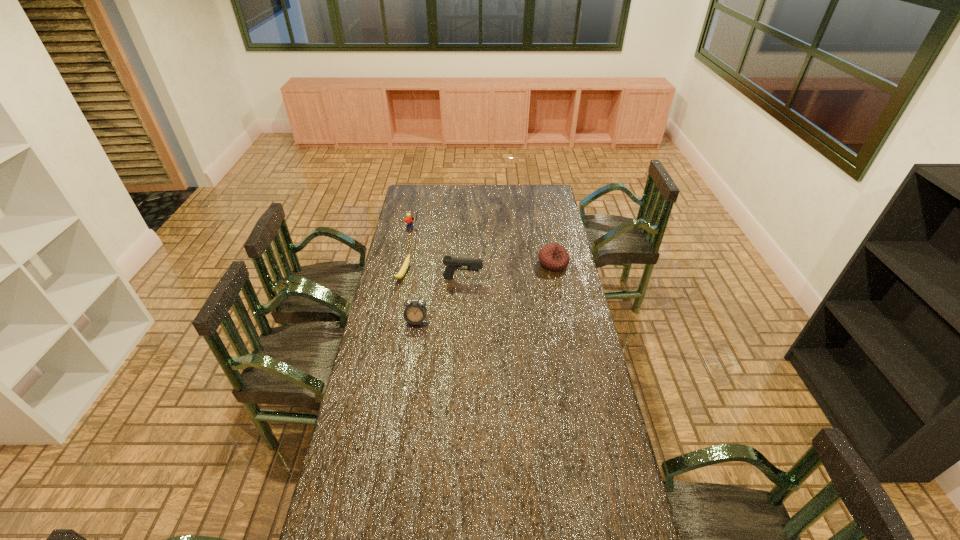
This screenshot has width=960, height=540. I want to click on free region located 0.220m on the upward curve of the banana, so 452,285.

Locate an element on the screen. The width and height of the screenshot is (960, 540). free spot located on the upward curve of the banana is located at coordinates (432, 281).

Where is `vacant region located 0.270m on the front-facing side of the Lego`? Image resolution: width=960 pixels, height=540 pixels. vacant region located 0.270m on the front-facing side of the Lego is located at coordinates (446, 253).

Where is `vacant space located on the front-facing side of the Lego`? Image resolution: width=960 pixels, height=540 pixels. vacant space located on the front-facing side of the Lego is located at coordinates (445, 252).

In order to click on free region located 0.280m on the front-facing side of the Lego in this screenshot , I will do `click(447, 254)`.

This screenshot has height=540, width=960. I want to click on vacant space situated 0.230m at the barrel of the pistol, so click(531, 282).

Locate an element on the screen. vacant area located at the barrel of the pistol is located at coordinates (516, 281).

At what (x,y) coordinates should I click in order to perform the action: click on vacant space located 0.190m at the barrel of the pistol. Please return your answer as a coordinate pair (x, y). The height and width of the screenshot is (540, 960). Looking at the image, I should click on (523, 282).

Where is `alarm clock present at the left edge`? alarm clock present at the left edge is located at coordinates (415, 312).

The image size is (960, 540). I want to click on banana that is positioned at the left edge, so click(401, 273).